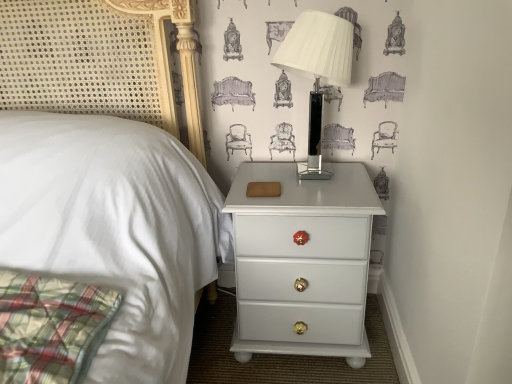
Find the location of a particular element. free spot below white glossy table lamp at upper right (from a real-world perspective) is located at coordinates (311, 173).